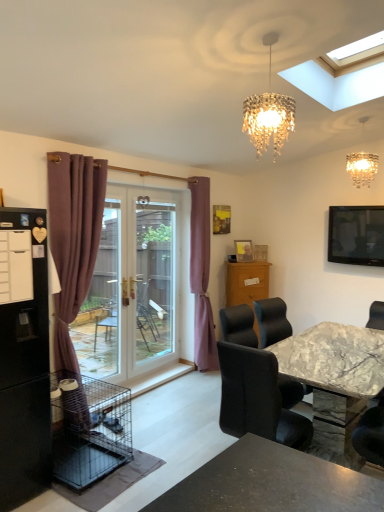
Question: Can you confirm if black wire birdcage at lower left is shorter than wooden picture frame at center?

Choices:
 (A) yes
 (B) no

Answer: (B)

Question: Is black wire birdcage at lower left positioned with its back to wooden picture frame at center?

Choices:
 (A) yes
 (B) no

Answer: (B)

Question: Can you confirm if black wire birdcage at lower left is taller than wooden picture frame at center?

Choices:
 (A) no
 (B) yes

Answer: (B)

Question: Would you say black wire birdcage at lower left contains wooden picture frame at center?

Choices:
 (A) no
 (B) yes

Answer: (A)

Question: Would you say black wire birdcage at lower left is outside wooden picture frame at center?

Choices:
 (A) no
 (B) yes

Answer: (B)

Question: Is point (51, 165) closer or farther from the camera than point (360, 416)?

Choices:
 (A) closer
 (B) farther

Answer: (B)

Question: In terms of size, does mauve velvet curtain at left, placed as the 2th curtain when sorted from back to front, appear bigger or smaller than marble-textured chair at lower right?

Choices:
 (A) small
 (B) big

Answer: (B)

Question: Would you say mauve velvet curtain at left, placed as the 2th curtain when sorted from back to front, is to the left or to the right of marble-textured chair at lower right in the picture?

Choices:
 (A) left
 (B) right

Answer: (A)

Question: Is mauve velvet curtain at left, the 2th curtain viewed from the right, situated inside marble-textured chair at lower right or outside?

Choices:
 (A) inside
 (B) outside

Answer: (B)

Question: In the image, is black wire birdcage at lower left on the left side or the right side of mauve fabric curtain at center, acting as the 1th curtain starting from the back?

Choices:
 (A) left
 (B) right

Answer: (A)

Question: Based on their sizes in the image, would you say black wire birdcage at lower left is bigger or smaller than mauve fabric curtain at center, acting as the 1th curtain starting from the back?

Choices:
 (A) small
 (B) big

Answer: (A)

Question: Is point (77, 474) positioned closer to the camera than point (195, 242)?

Choices:
 (A) farther
 (B) closer

Answer: (B)

Question: Is black wire birdcage at lower left inside the boundaries of mauve fabric curtain at center, which is the 2th curtain from left to right, or outside?

Choices:
 (A) outside
 (B) inside

Answer: (A)

Question: Considering the positions of point (137, 296) and point (354, 243), is point (137, 296) closer or farther from the camera than point (354, 243)?

Choices:
 (A) farther
 (B) closer

Answer: (A)

Question: In terms of width, does transparent glass screen door at center look wider or thinner when compared to flat screen tv at upper right?

Choices:
 (A) wide
 (B) thin

Answer: (B)